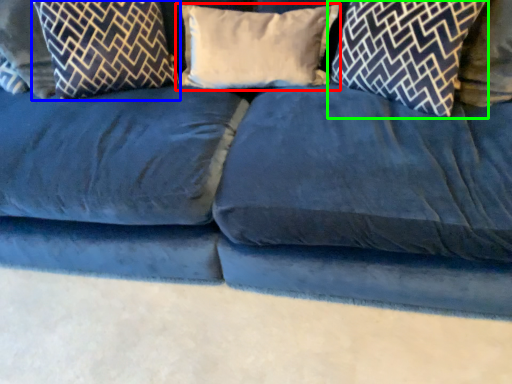
Question: Estimate the real-world distances between objects in this image. Which object is closer to pillow (highlighted by a red box), pillow (highlighted by a blue box) or pillow (highlighted by a green box)?

Choices:
 (A) pillow
 (B) pillow

Answer: (B)